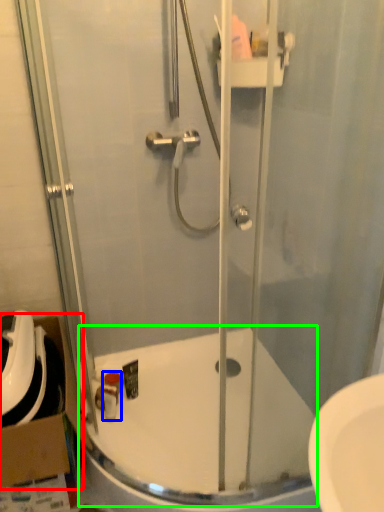
Question: Considering the real-world distances, which object is farthest from cardboard box (highlighted by a red box)? toiletry (highlighted by a blue box) or bath (highlighted by a green box)?

Choices:
 (A) toiletry
 (B) bath

Answer: (B)